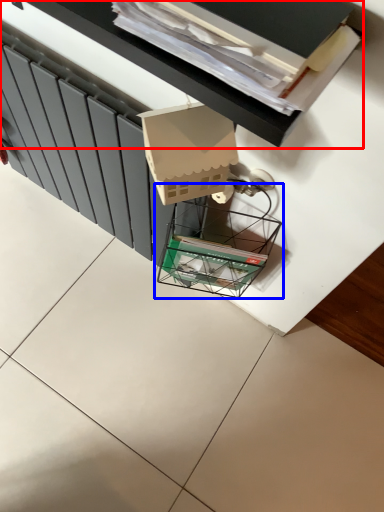
Question: Among these objects, which one is farthest to the camera, vanity (highlighted by a red box) or glass box (highlighted by a blue box)?

Choices:
 (A) vanity
 (B) glass box

Answer: (B)